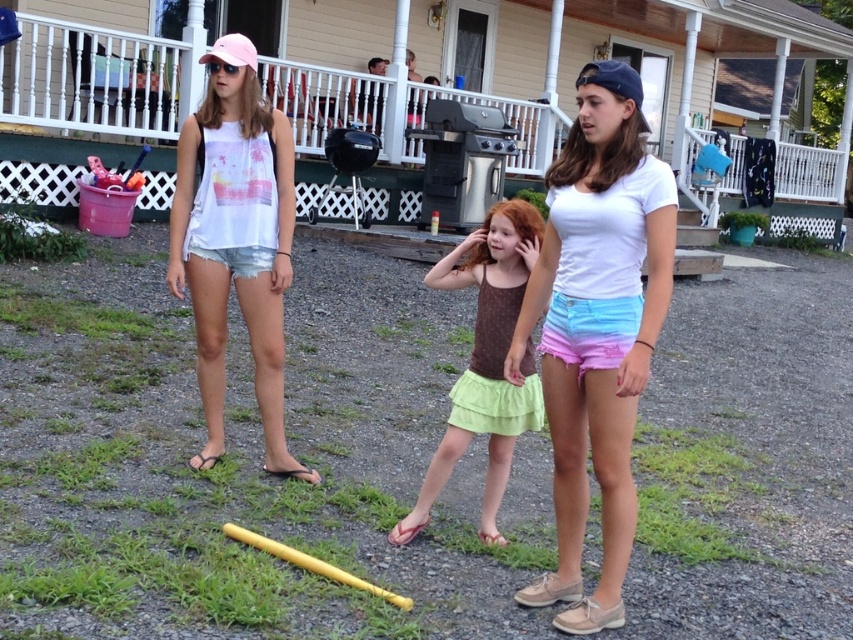
You are standing on the porch and want to pick up the yellow plastic bat at center. However, you need to step over the denim shorts at left. Is the bat closer to you than the shorts?

The yellow plastic bat at center is closer to the viewer than the denim shorts at left, so yes, the bat is closer to you than the shorts.

You are organizing a sports day event and need to ensure equipment fits in storage boxes. The yellow plastic bat at center and the denim shorts at left must be packed. Which item requires a larger storage box?

The yellow plastic bat at center requires a larger storage box because it is larger in size than the denim shorts at left.

You are trying to determine the relative sizes of the objects in the scene. Which object is wider, the denim shorts at left or the yellow matte baseball bat at lower center?

The yellow matte baseball bat at lower center is wider than the denim shorts at left.